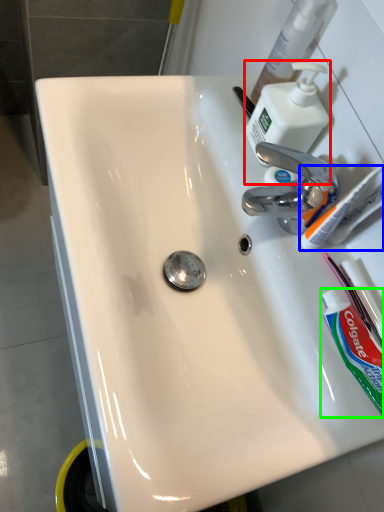
Question: Based on their relative distances, which object is nearer to soap dispenser (highlighted by a red box)? Choose from toothbrush (highlighted by a blue box) and toothpaste (highlighted by a green box).

Choices:
 (A) toothbrush
 (B) toothpaste

Answer: (A)